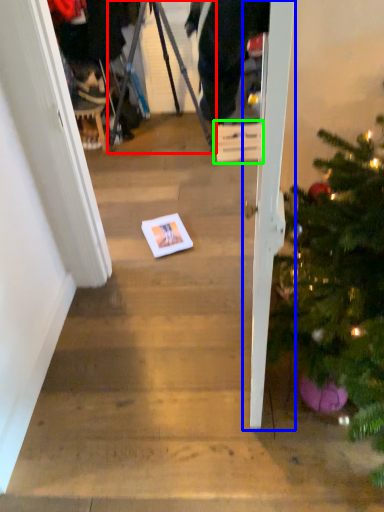
Question: Considering the real-world distances, which object is farthest from tripod (highlighted by a red box)? door (highlighted by a blue box) or cardboard box (highlighted by a green box)?

Choices:
 (A) door
 (B) cardboard box

Answer: (A)